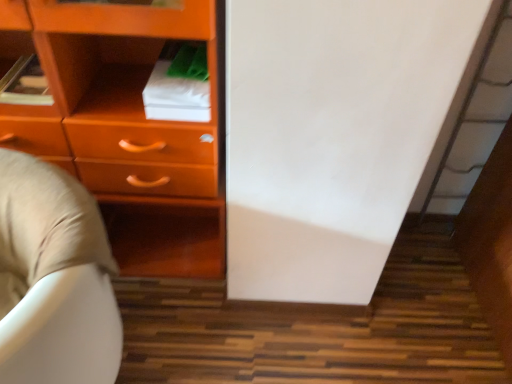
This screenshot has height=384, width=512. Describe the element at coordinates (126, 127) in the screenshot. I see `matte orange chest of drawers at left` at that location.

What is the approximate height of matte orange chest of drawers at left?

matte orange chest of drawers at left is 39.13 inches in height.

At what (x,y) coordinates should I click in order to perform the action: click on matte orange chest of drawers at left. Please return your answer as a coordinate pair (x, y). Image resolution: width=512 pixels, height=384 pixels. Looking at the image, I should click on (126, 127).

What is the approximate width of matte orange chest of drawers at left?

The width of matte orange chest of drawers at left is 14.41 inches.

Measure the distance between point (x=2, y=104) and camera.

The distance of point (x=2, y=104) from camera is 1.13 meters.

The height and width of the screenshot is (384, 512). Find the location of `beige fabric bean bag chair at lower left`. beige fabric bean bag chair at lower left is located at coordinates (54, 279).

Describe the element at coordinates (54, 279) in the screenshot. I see `beige fabric bean bag chair at lower left` at that location.

Identify the location of matte orange chest of drawers at left. click(x=126, y=127).

In the image, is matte orange chest of drawers at left on the left side or the right side of beige fabric bean bag chair at lower left?

In the image, matte orange chest of drawers at left appears on the right side of beige fabric bean bag chair at lower left.

Does matte orange chest of drawers at left lie behind beige fabric bean bag chair at lower left?

Yes, matte orange chest of drawers at left is further from the camera.

Which is in front, point (147, 194) or point (85, 298)?

The point (85, 298) is in front.

From the image's perspective, which one is positioned lower, matte orange chest of drawers at left or beige fabric bean bag chair at lower left?

beige fabric bean bag chair at lower left appears lower in the image.

From a real-world perspective, is matte orange chest of drawers at left physically below beige fabric bean bag chair at lower left?

Incorrect, from a real-world perspective, matte orange chest of drawers at left is higher than beige fabric bean bag chair at lower left.

In terms of width, does matte orange chest of drawers at left look wider or thinner when compared to beige fabric bean bag chair at lower left?

Clearly, matte orange chest of drawers at left has more width compared to beige fabric bean bag chair at lower left.

Which of these two, matte orange chest of drawers at left or beige fabric bean bag chair at lower left, stands shorter?

Standing shorter between the two is beige fabric bean bag chair at lower left.

Who is bigger, matte orange chest of drawers at left or beige fabric bean bag chair at lower left?

With larger size is matte orange chest of drawers at left.

Is matte orange chest of drawers at left outside of beige fabric bean bag chair at lower left?

Absolutely, matte orange chest of drawers at left is external to beige fabric bean bag chair at lower left.

Would you say matte orange chest of drawers at left is a long distance from beige fabric bean bag chair at lower left?

No, matte orange chest of drawers at left is not far from beige fabric bean bag chair at lower left.

Is matte orange chest of drawers at left looking in the opposite direction of beige fabric bean bag chair at lower left?

Yes, matte orange chest of drawers at left is facing away from beige fabric bean bag chair at lower left.

How distant is matte orange chest of drawers at left from beige fabric bean bag chair at lower left?

The distance of matte orange chest of drawers at left from beige fabric bean bag chair at lower left is 13.25 inches.

Where is `bean bag chair located on the left of matte orange chest of drawers at left`? bean bag chair located on the left of matte orange chest of drawers at left is located at coordinates (54, 279).

Is beige fabric bean bag chair at lower left to the left of matte orange chest of drawers at left from the viewer's perspective?

Correct, you'll find beige fabric bean bag chair at lower left to the left of matte orange chest of drawers at left.

Which object is closer to the camera taking this photo, beige fabric bean bag chair at lower left or matte orange chest of drawers at left?

beige fabric bean bag chair at lower left.

Does point (101, 357) lie in front of point (49, 44)?

No, (101, 357) is behind (49, 44).

From the image's perspective, is beige fabric bean bag chair at lower left located above or below matte orange chest of drawers at left?

From the image's perspective, beige fabric bean bag chair at lower left appears below matte orange chest of drawers at left.

From a real-world perspective, is beige fabric bean bag chair at lower left physically below matte orange chest of drawers at left?

Correct, in the physical world, beige fabric bean bag chair at lower left is lower than matte orange chest of drawers at left.

Considering the sizes of objects beige fabric bean bag chair at lower left and matte orange chest of drawers at left in the image provided, who is thinner, beige fabric bean bag chair at lower left or matte orange chest of drawers at left?

beige fabric bean bag chair at lower left is thinner.

Considering the sizes of objects beige fabric bean bag chair at lower left and matte orange chest of drawers at left in the image provided, who is shorter, beige fabric bean bag chair at lower left or matte orange chest of drawers at left?

beige fabric bean bag chair at lower left is shorter.

Based on the photo, can you confirm if beige fabric bean bag chair at lower left is smaller than matte orange chest of drawers at left?

Yes.

Is beige fabric bean bag chair at lower left positioned beyond the bounds of matte orange chest of drawers at left?

Yes, beige fabric bean bag chair at lower left is outside of matte orange chest of drawers at left.

Are beige fabric bean bag chair at lower left and matte orange chest of drawers at left far apart?

beige fabric bean bag chair at lower left is actually quite close to matte orange chest of drawers at left.

Is beige fabric bean bag chair at lower left facing away from matte orange chest of drawers at left?

Yes, matte orange chest of drawers at left is at the back of beige fabric bean bag chair at lower left.

What's the angular difference between beige fabric bean bag chair at lower left and matte orange chest of drawers at left's facing directions?

The facing directions of beige fabric bean bag chair at lower left and matte orange chest of drawers at left are 27.7 degrees apart.

Measure the distance from beige fabric bean bag chair at lower left to matte orange chest of drawers at left.

beige fabric bean bag chair at lower left and matte orange chest of drawers at left are 13.25 inches apart.

Where is `bean bag chair in front of the matte orange chest of drawers at left`? The height and width of the screenshot is (384, 512). bean bag chair in front of the matte orange chest of drawers at left is located at coordinates (54, 279).

Locate an element on the screen. This screenshot has width=512, height=384. chest of drawers that appears on the right of beige fabric bean bag chair at lower left is located at coordinates (126, 127).

Where is `the chest of drawers above the beige fabric bean bag chair at lower left (from a real-world perspective)`? the chest of drawers above the beige fabric bean bag chair at lower left (from a real-world perspective) is located at coordinates (126, 127).